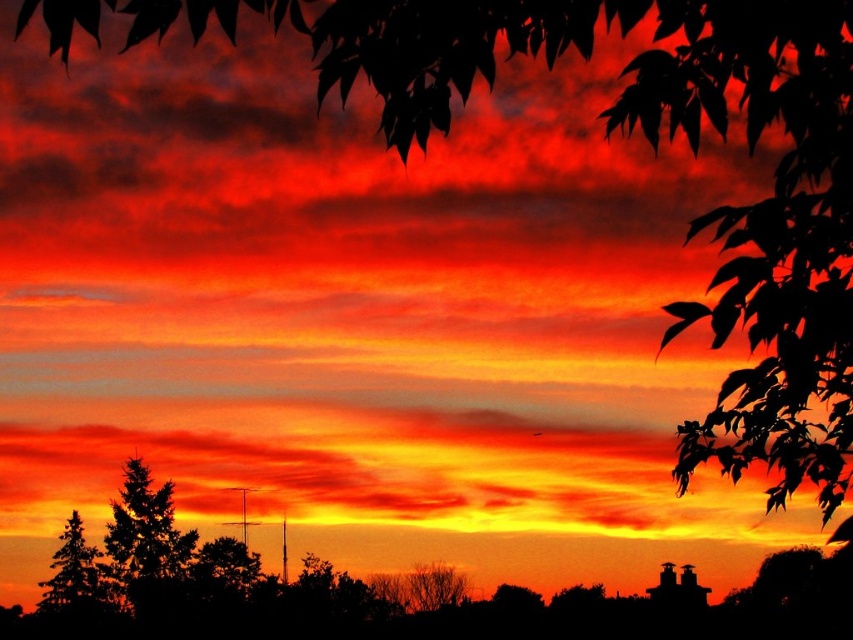
Question: Is silhouette evergreen tree at lower left bigger than bare branches at lower center?

Choices:
 (A) yes
 (B) no

Answer: (B)

Question: Which object is farther from the camera taking this photo?

Choices:
 (A) bare branches at lower center
 (B) silhouette evergreen tree at lower left

Answer: (B)

Question: In this image, where is silhouette evergreen tree at lower left located relative to bare branches at lower center?

Choices:
 (A) above
 (B) below

Answer: (A)

Question: Is silhouette evergreen tree at lower left positioned in front of bare branches at lower center?

Choices:
 (A) yes
 (B) no

Answer: (B)